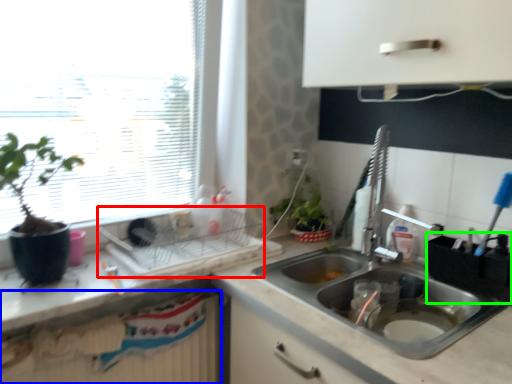
Question: Which object is positioned farthest from appliance (highlighted by a red box)? Select from radiator (highlighted by a blue box) and appliance (highlighted by a green box).

Choices:
 (A) radiator
 (B) appliance

Answer: (B)